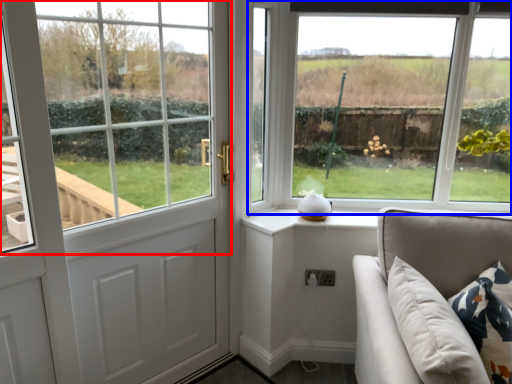
Question: Which object appears closest to the camera in this image, window (highlighted by a red box) or window (highlighted by a blue box)?

Choices:
 (A) window
 (B) window

Answer: (A)